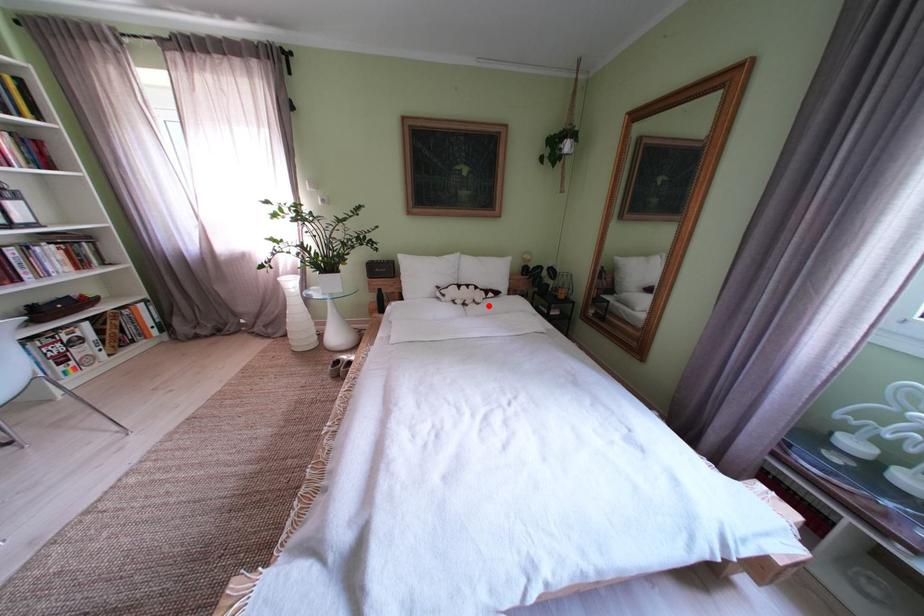
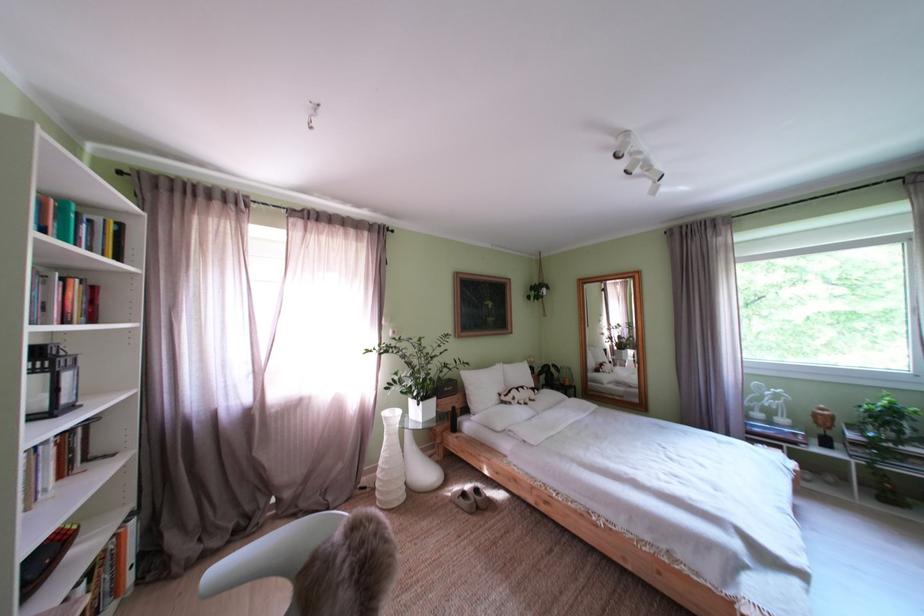
Question: I am providing you with two images of the same scene from different viewpoints. Given a red point in image1, look at the same physical point in image2. Is it:

Choices:
 (A) Closer to the viewpoint
 (B) Farther from the viewpoint

Answer: (B)